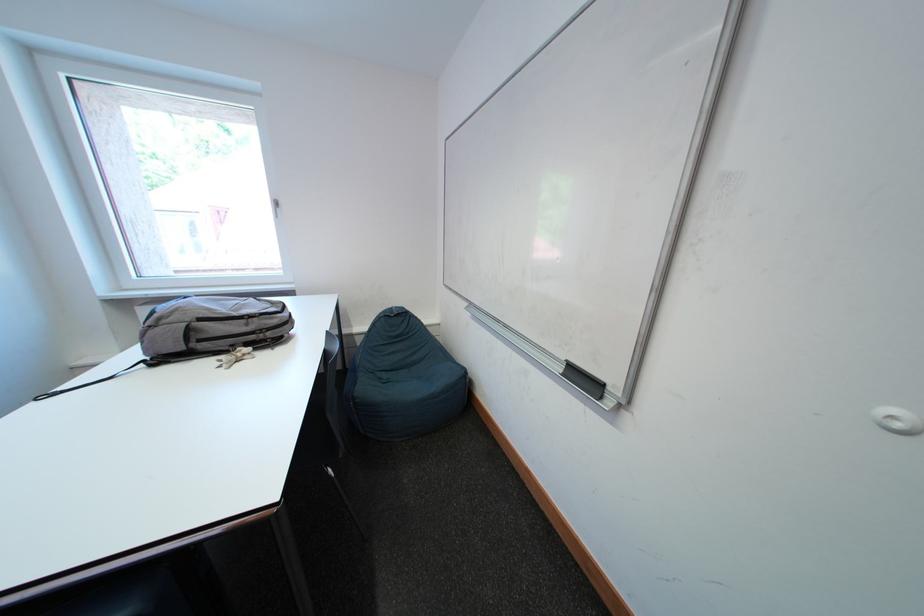
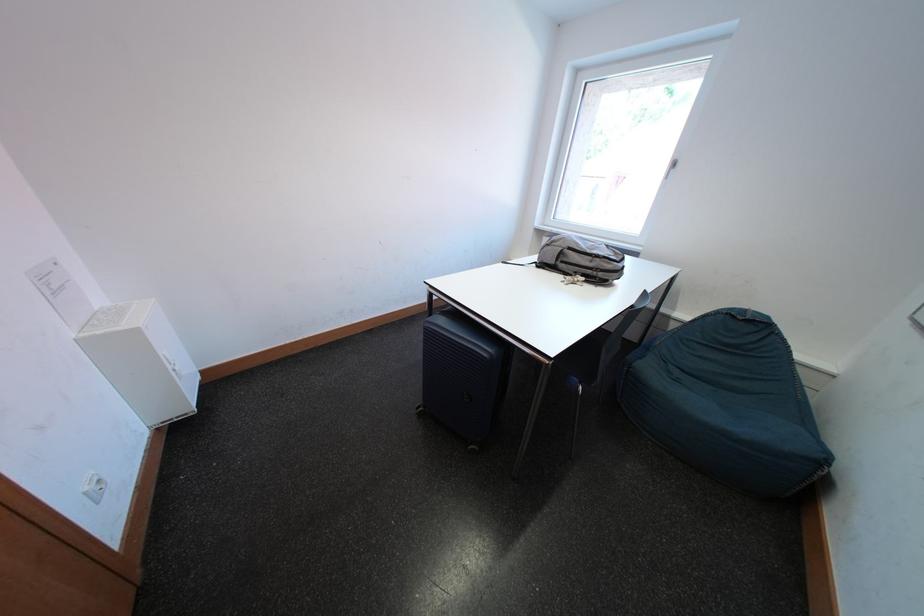
The point at (257, 328) is marked in the first image. Where is the corresponding point in the second image?

(601, 265)